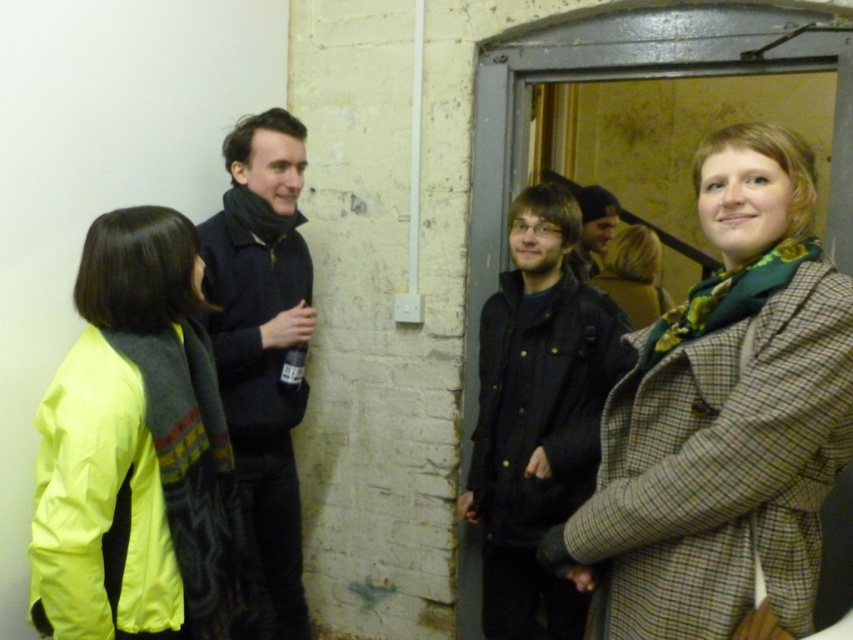
Which is behind, point (173, 372) or point (601, 228)?

Positioned behind is point (601, 228).

Which is in front, point (206, 384) or point (612, 230)?

Point (206, 384) is more forward.

Image resolution: width=853 pixels, height=640 pixels. Describe the element at coordinates (134, 449) in the screenshot. I see `neon yellow fabric at left` at that location.

At what (x,y) coordinates should I click in order to perform the action: click on neon yellow fabric at left. Please return your answer as a coordinate pair (x, y). Looking at the image, I should click on (134, 449).

Is green plaid coat at center closer to camera compared to dark brown leather jacket at center?

Yes, green plaid coat at center is in front of dark brown leather jacket at center.

Does green plaid coat at center appear on the left side of dark brown leather jacket at center?

No, green plaid coat at center is not to the left of dark brown leather jacket at center.

Describe the element at coordinates (723, 419) in the screenshot. The height and width of the screenshot is (640, 853). I see `green plaid coat at center` at that location.

Identify the location of green plaid coat at center. The height and width of the screenshot is (640, 853). (723, 419).

Who is lower down, neon yellow fabric at left or green plaid coat at right?

neon yellow fabric at left is lower down.

Is neon yellow fabric at left positioned before green plaid coat at right?

Yes.

What do you see at coordinates (134, 449) in the screenshot?
I see `neon yellow fabric at left` at bounding box center [134, 449].

This screenshot has width=853, height=640. I want to click on neon yellow fabric at left, so (x=134, y=449).